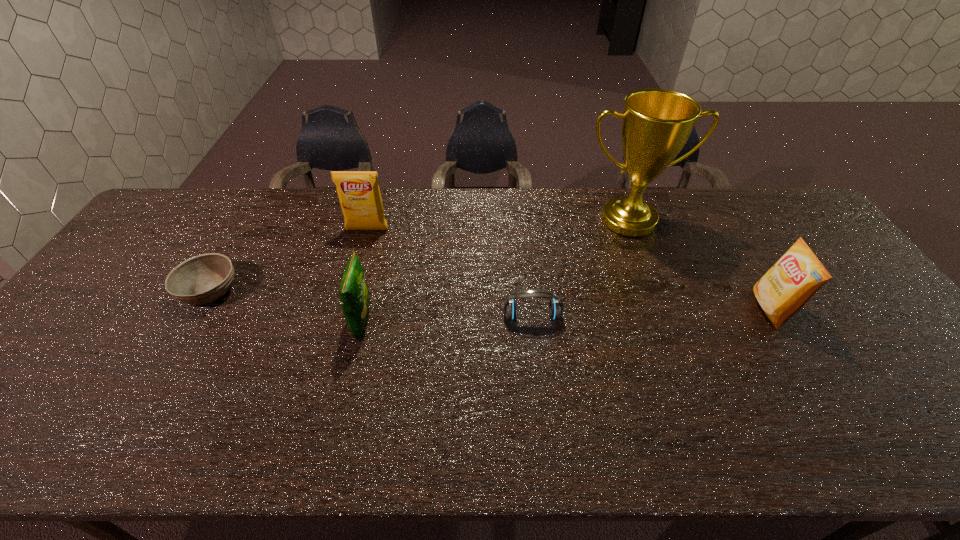
Where is `vacant space at the right edge of the desktop`? vacant space at the right edge of the desktop is located at coordinates (821, 242).

You are a GUI agent. You are given a task and a screenshot of the screen. Output one action in this format:
    pyautogui.click(x=<x>, y=<y>)
    Task: Click on the vacant space at the far left corner
    This screenshot has width=960, height=540.
    Given the screenshot: What is the action you would take?
    pyautogui.click(x=197, y=190)

I want to click on free space that is in between the fifth tallest object and the award, so click(580, 268).

The width and height of the screenshot is (960, 540). Identify the location of vacant point located between the fifth object from left to right and the farthest crisp (potato chip). (497, 225).

Identify the location of empty space that is in between the headset and the rightmost object. This screenshot has height=540, width=960. (651, 313).

The height and width of the screenshot is (540, 960). In order to click on free space between the rightmost crisp (potato chip) and the award in this screenshot , I will do `click(699, 265)`.

Locate an element on the screen. The image size is (960, 540). empty location between the second object from right to left and the farthest crisp (potato chip) is located at coordinates (497, 225).

Locate an element on the screen. Image resolution: width=960 pixels, height=540 pixels. vacant region between the farthest crisp (potato chip) and the tallest object is located at coordinates (497, 225).

The height and width of the screenshot is (540, 960). Identify the location of free space between the shortest object and the third object from right to left. (371, 303).

The height and width of the screenshot is (540, 960). In order to click on unoccupied position between the second shortest object and the bowl in this screenshot , I will do `click(371, 303)`.